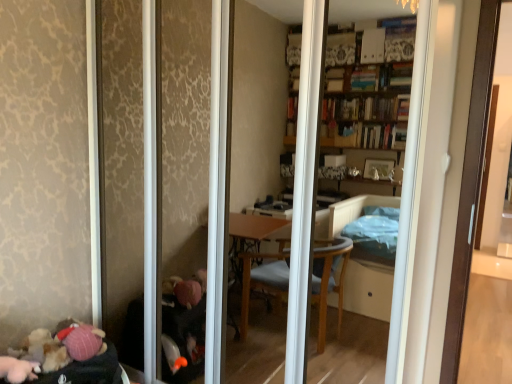
The image size is (512, 384). What do you see at coordinates (412, 125) in the screenshot? I see `white glossy door at center` at bounding box center [412, 125].

In order to face white glossy door at center, should I rotate leftwards or rightwards?

You should look left and rotate roughly 0.749 degrees.

The image size is (512, 384). Find the location of `white glossy door at center`. white glossy door at center is located at coordinates (412, 125).

The height and width of the screenshot is (384, 512). Find the location of `white glossy door at center`. white glossy door at center is located at coordinates (412, 125).